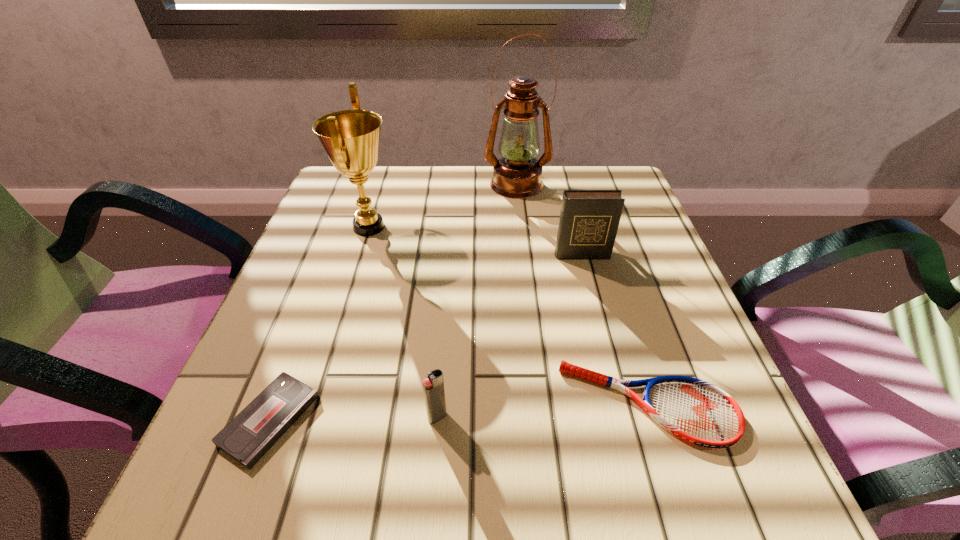
At what (x,y) coordinates should I click in order to perform the action: click on free space that satisfies the following two spatial constraints: 1. on the front view with handles of the award; 2. on the back side of the third shortest object. Please return your answer as a coordinate pair (x, y). Image resolution: width=960 pixels, height=540 pixels. Looking at the image, I should click on (310, 417).